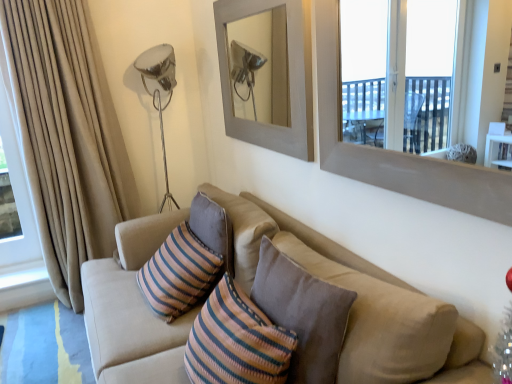
Question: Is beige fabric curtain at left in contact with gray matte picture frame at upper center?

Choices:
 (A) yes
 (B) no

Answer: (B)

Question: Is beige fabric curtain at left to the right of gray matte picture frame at upper center from the viewer's perspective?

Choices:
 (A) no
 (B) yes

Answer: (A)

Question: Can you confirm if beige fabric curtain at left is wider than gray matte picture frame at upper center?

Choices:
 (A) no
 (B) yes

Answer: (B)

Question: Does beige fabric curtain at left come behind gray matte picture frame at upper center?

Choices:
 (A) no
 (B) yes

Answer: (B)

Question: Does beige fabric curtain at left have a larger size compared to gray matte picture frame at upper center?

Choices:
 (A) no
 (B) yes

Answer: (B)

Question: From a real-world perspective, is beige fabric couch at center physically located above or below beige fabric curtain at left?

Choices:
 (A) below
 (B) above

Answer: (A)

Question: In terms of width, does beige fabric couch at center look wider or thinner when compared to beige fabric curtain at left?

Choices:
 (A) thin
 (B) wide

Answer: (B)

Question: Relative to beige fabric curtain at left, is beige fabric couch at center in front or behind?

Choices:
 (A) behind
 (B) front

Answer: (B)

Question: Looking at the image, does beige fabric couch at center seem bigger or smaller compared to beige fabric curtain at left?

Choices:
 (A) small
 (B) big

Answer: (B)

Question: From a real-world perspective, is smooth gray window frame at upper right physically located above or below gray matte picture frame at upper center?

Choices:
 (A) below
 (B) above

Answer: (A)

Question: Does point (330, 1) appear closer or farther from the camera than point (303, 132)?

Choices:
 (A) farther
 (B) closer

Answer: (B)

Question: In the image, is smooth gray window frame at upper right positioned in front of or behind gray matte picture frame at upper center?

Choices:
 (A) front
 (B) behind

Answer: (A)

Question: Do you think smooth gray window frame at upper right is within gray matte picture frame at upper center, or outside of it?

Choices:
 (A) outside
 (B) inside

Answer: (A)

Question: Would you say beige fabric curtain at left is to the left or to the right of beige fabric couch at center in the picture?

Choices:
 (A) right
 (B) left

Answer: (B)

Question: From their relative heights in the image, would you say beige fabric curtain at left is taller or shorter than beige fabric couch at center?

Choices:
 (A) short
 (B) tall

Answer: (B)